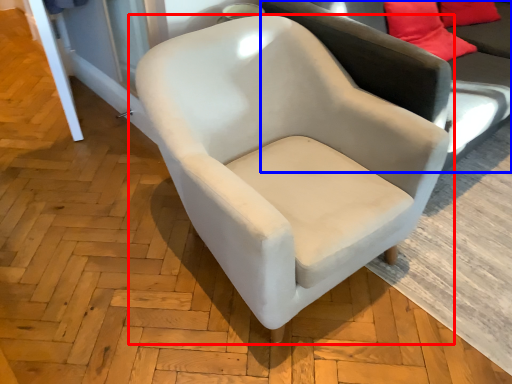
Question: Which point is further to the camera, chair (highlighted by a red box) or studio couch (highlighted by a blue box)?

Choices:
 (A) chair
 (B) studio couch

Answer: (B)